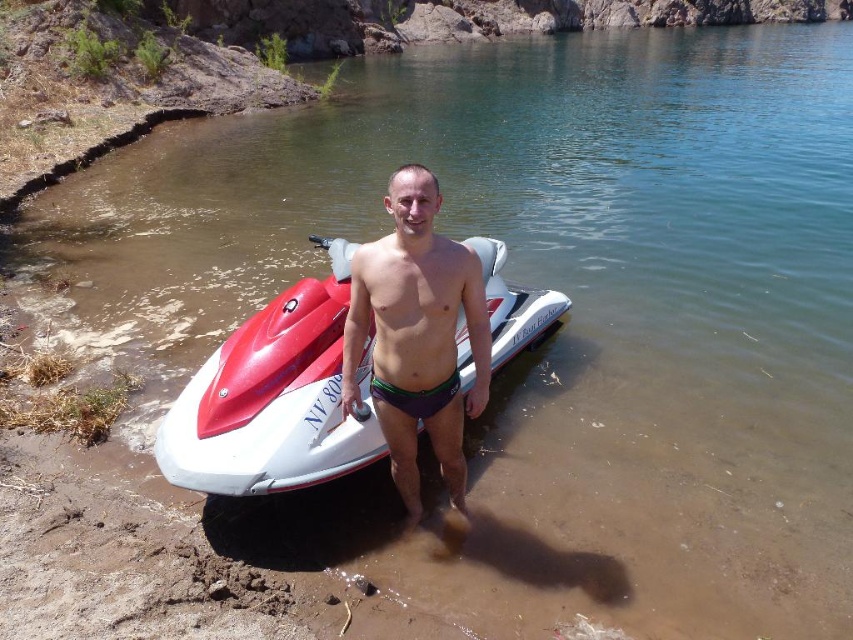
I want to click on red glossy jet ski at center, so click(274, 397).

Between red glossy jet ski at center and purple matte swim trunks at center, which one is positioned higher?

red glossy jet ski at center is above.

Between point (276, 465) and point (389, 189), which one is positioned in front?

Point (389, 189) is more forward.

Identify the location of red glossy jet ski at center. Image resolution: width=853 pixels, height=640 pixels. (274, 397).